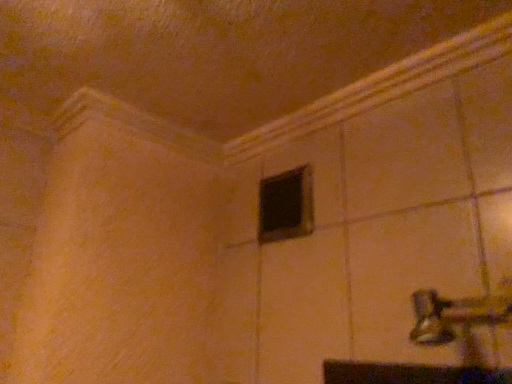
Question: From their relative heights in the image, would you say black matte window at center is taller or shorter than metallic silver door handle at lower right?

Choices:
 (A) short
 (B) tall

Answer: (B)

Question: From the image's perspective, relative to metallic silver door handle at lower right, is black matte window at center above or below?

Choices:
 (A) above
 (B) below

Answer: (A)

Question: Relative to metallic silver door handle at lower right, is black matte window at center in front or behind?

Choices:
 (A) front
 (B) behind

Answer: (B)

Question: Visually, is metallic silver door handle at lower right positioned to the left or to the right of black matte window at center?

Choices:
 (A) right
 (B) left

Answer: (A)

Question: In terms of size, does metallic silver door handle at lower right appear bigger or smaller than black matte window at center?

Choices:
 (A) big
 (B) small

Answer: (A)

Question: Is point (464, 306) closer or farther from the camera than point (280, 195)?

Choices:
 (A) closer
 (B) farther

Answer: (A)

Question: In the image, is metallic silver door handle at lower right positioned in front of or behind black matte window at center?

Choices:
 (A) front
 (B) behind

Answer: (A)